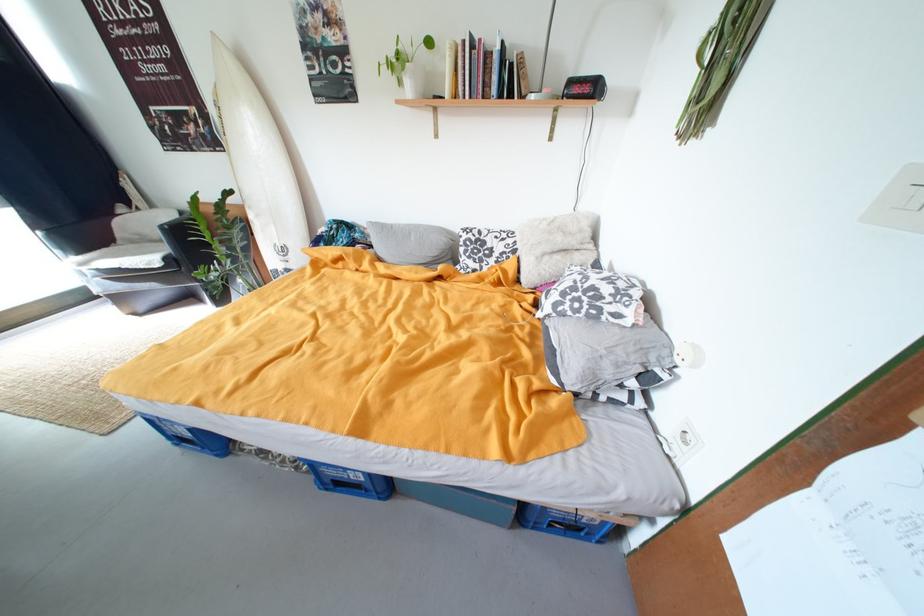
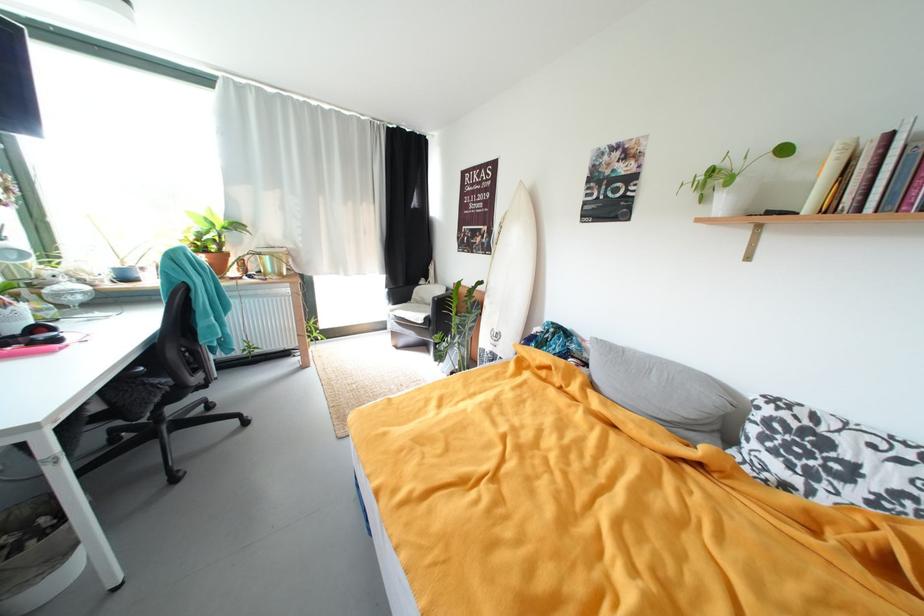
Find the pixel in the second image that matches point 91,265 in the first image.

(399, 313)